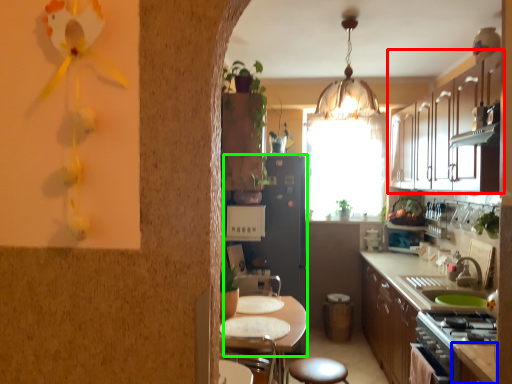
Question: Which object is positioned closest to cabinetry (highlighted by a red box)? Select from counter top (highlighted by a blue box) and fridge (highlighted by a green box).

Choices:
 (A) counter top
 (B) fridge

Answer: (B)